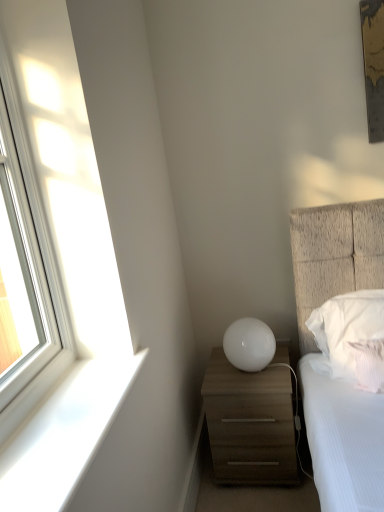
Question: From the image's perspective, is matte wood chest of drawers at lower right on white textured pillow at right, arranged as the first pillow when viewed from the front?

Choices:
 (A) no
 (B) yes

Answer: (A)

Question: Does matte wood chest of drawers at lower right have a smaller size compared to white textured pillow at right, arranged as the first pillow when viewed from the front?

Choices:
 (A) no
 (B) yes

Answer: (A)

Question: Can you confirm if matte wood chest of drawers at lower right is taller than white textured pillow at right, arranged as the first pillow when viewed from the front?

Choices:
 (A) yes
 (B) no

Answer: (A)

Question: Is matte wood chest of drawers at lower right to the left of white textured pillow at right, which is the second pillow from back to front, from the viewer's perspective?

Choices:
 (A) yes
 (B) no

Answer: (A)

Question: Is the surface of matte wood chest of drawers at lower right in direct contact with white textured pillow at right, arranged as the first pillow when viewed from the front?

Choices:
 (A) no
 (B) yes

Answer: (A)

Question: From the image's perspective, does matte wood chest of drawers at lower right appear lower than white textured pillow at right, arranged as the first pillow when viewed from the front?

Choices:
 (A) no
 (B) yes

Answer: (B)

Question: From the image's perspective, is white textured pillow at right, arranged as the first pillow when viewed from the front, on clear glass window at left?

Choices:
 (A) no
 (B) yes

Answer: (A)

Question: Does white textured pillow at right, which is the second pillow from back to front, lie behind clear glass window at left?

Choices:
 (A) no
 (B) yes

Answer: (B)

Question: From the image's perspective, is white textured pillow at right, arranged as the first pillow when viewed from the front, beneath clear glass window at left?

Choices:
 (A) no
 (B) yes

Answer: (B)

Question: Is white textured pillow at right, arranged as the first pillow when viewed from the front, in front of clear glass window at left?

Choices:
 (A) yes
 (B) no

Answer: (B)

Question: Can you confirm if white textured pillow at right, which is the second pillow from back to front, is thinner than clear glass window at left?

Choices:
 (A) yes
 (B) no

Answer: (B)

Question: Is white textured pillow at right, which is the second pillow from back to front, oriented away from clear glass window at left?

Choices:
 (A) yes
 (B) no

Answer: (B)

Question: From the image's perspective, is white textured pillow at right, which is the second pillow from back to front, under white glossy sphere at center?

Choices:
 (A) no
 (B) yes

Answer: (B)